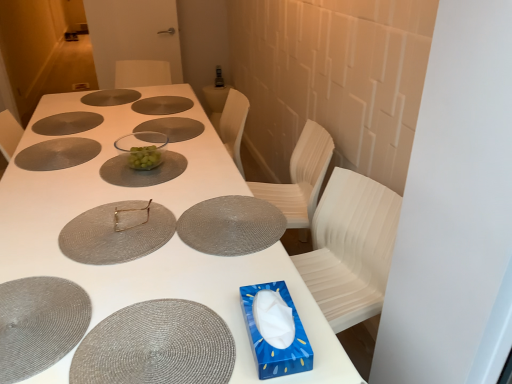
This screenshot has width=512, height=384. In order to click on free area in between transparent glass bowl at center, acting as the sixth glass plate starting from the back, and transparent glass bowl at center, acting as the 6th glass plate starting from the front in this screenshot , I will do `click(156, 140)`.